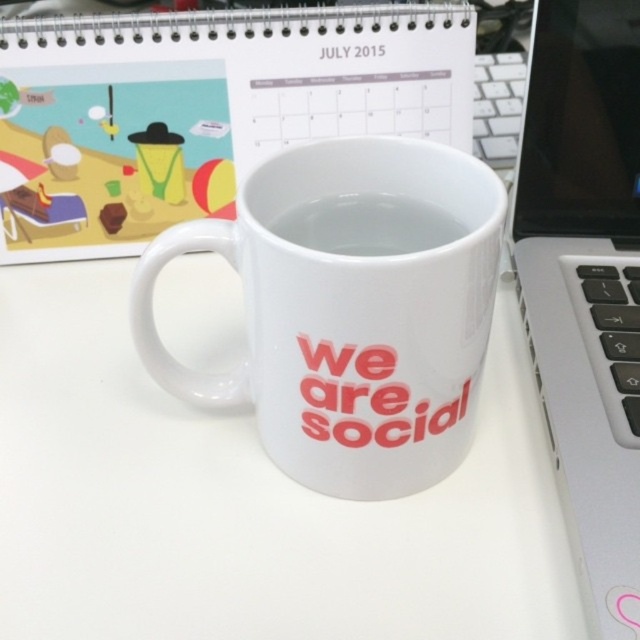
Question: Is white glossy notebook at upper center positioned in front of silver metallic laptop at right?

Choices:
 (A) no
 (B) yes

Answer: (A)

Question: Among these objects, which one is farthest from the camera?

Choices:
 (A) white glossy mug at center
 (B) transparent glass coffee at center
 (C) white glossy notebook at upper center

Answer: (C)

Question: Which of the following is the closest to the observer?

Choices:
 (A) white glossy table at center
 (B) white glossy mug at center

Answer: (B)

Question: From the image, what is the correct spatial relationship of white glossy mug at center in relation to silver metallic laptop at right?

Choices:
 (A) left
 (B) right

Answer: (A)

Question: Which object appears farthest from the camera in this image?

Choices:
 (A) transparent glass coffee at center
 (B) white glossy notebook at upper center
 (C) white glossy mug at center

Answer: (B)

Question: From the image, what is the correct spatial relationship of silver metallic laptop at right in relation to transparent glass coffee at center?

Choices:
 (A) below
 (B) above

Answer: (A)